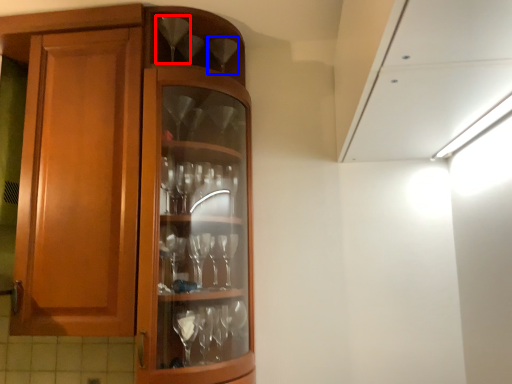
Question: Which of the following is the closest to the observer, wine glass (highlighted by a red box) or wine glass (highlighted by a blue box)?

Choices:
 (A) wine glass
 (B) wine glass

Answer: (A)